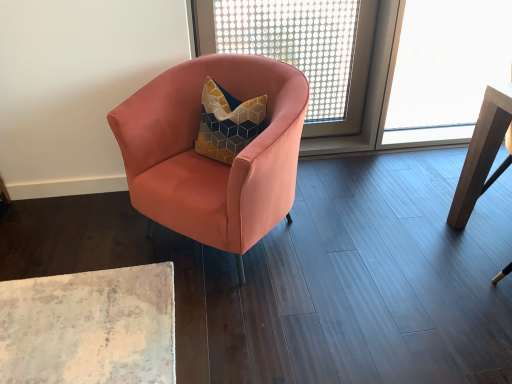
Question: Is transparent plastic screen at upper center thinner than wooden table at right?

Choices:
 (A) no
 (B) yes

Answer: (B)

Question: Is wooden table at right at the back of transparent plastic screen at upper center?

Choices:
 (A) no
 (B) yes

Answer: (A)

Question: From the image's perspective, is transparent plastic screen at upper center located above wooden table at right?

Choices:
 (A) no
 (B) yes

Answer: (B)

Question: Can you confirm if transparent plastic screen at upper center is shorter than wooden table at right?

Choices:
 (A) yes
 (B) no

Answer: (B)

Question: Is transparent plastic screen at upper center not within wooden table at right?

Choices:
 (A) no
 (B) yes

Answer: (B)

Question: Does point (188, 74) appear closer or farther from the camera than point (460, 210)?

Choices:
 (A) farther
 (B) closer

Answer: (B)

Question: From their relative heights in the image, would you say matte pink armchair at center is taller or shorter than wooden table at right?

Choices:
 (A) tall
 (B) short

Answer: (B)

Question: Which is correct: matte pink armchair at center is inside wooden table at right, or outside of it?

Choices:
 (A) inside
 (B) outside

Answer: (B)

Question: Looking at their shapes, would you say matte pink armchair at center is wider or thinner than wooden table at right?

Choices:
 (A) thin
 (B) wide

Answer: (B)

Question: From a real-world perspective, relative to matte pink armchair at center, is wooden table at right vertically above or below?

Choices:
 (A) below
 (B) above

Answer: (B)

Question: Is wooden table at right in front of or behind matte pink armchair at center in the image?

Choices:
 (A) behind
 (B) front

Answer: (A)

Question: Is wooden table at right spatially inside matte pink armchair at center, or outside of it?

Choices:
 (A) outside
 (B) inside

Answer: (A)

Question: From the image's perspective, relative to matte pink armchair at center, is wooden table at right above or below?

Choices:
 (A) below
 (B) above

Answer: (B)

Question: Considering their positions, is transparent plastic screen at upper center located in front of or behind wooden table at right?

Choices:
 (A) front
 (B) behind

Answer: (B)

Question: In terms of size, does transparent plastic screen at upper center appear bigger or smaller than wooden table at right?

Choices:
 (A) big
 (B) small

Answer: (B)